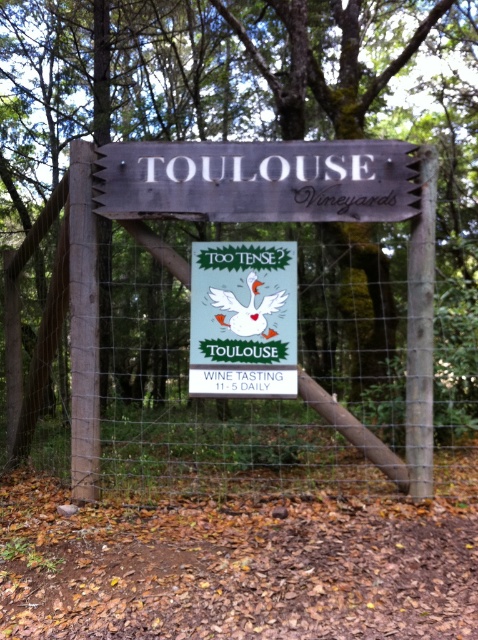
You are a painter who wants to paint both the wooden fence at center and the wooden signboard at center. Which object requires more paint because it has a larger surface area?

The wooden fence at center requires more paint because it has a larger size compared to the wooden signboard at center.

You are a hiker who just arrived at the wire fence with the wooden signboard at center and the matte green sign at center. You want to read both signs but need to decide which one to read first. Based on their positions, which sign should you approach first?

The wooden signboard at center is to the right of the matte green sign at center, so you should approach the matte green sign at center first since it is on the left side and closer to your starting position.

You are a delivery person carrying a package that is 2.5 meters long. You need to move it through the gap between the wooden fence at center and the wooden signboard at center. Will the package fit through the gap?

The wooden fence at center and wooden signboard at center are 2.45 meters apart from each other. Since the package is 2.5 meters long, it is slightly longer than the gap, so the package will not fit through the gap between the wooden fence at center and the wooden signboard at center.